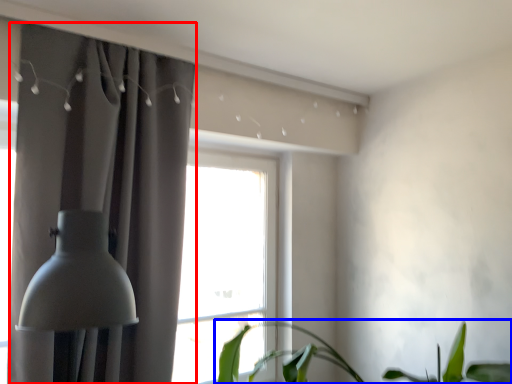
Question: Which object appears closest to the camera in this image, curtain (highlighted by a red box) or houseplant (highlighted by a blue box)?

Choices:
 (A) curtain
 (B) houseplant

Answer: (B)